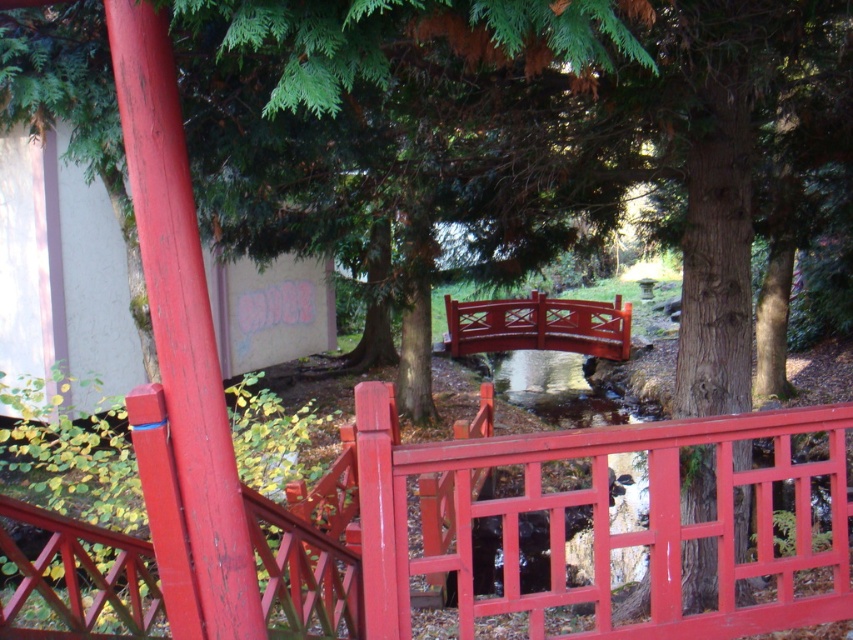
Is point (723, 496) behind point (570, 324)?

No.

Who is more distant from viewer, [329,477] or [624,330]?

The point [624,330] is behind.

Describe the element at coordinates (547, 525) in the screenshot. The height and width of the screenshot is (640, 853). I see `smooth glossy wood bridge at center` at that location.

At what (x,y) coordinates should I click in order to perform the action: click on smooth glossy wood bridge at center. Please return your answer as a coordinate pair (x, y). This screenshot has width=853, height=640. Looking at the image, I should click on (547, 525).